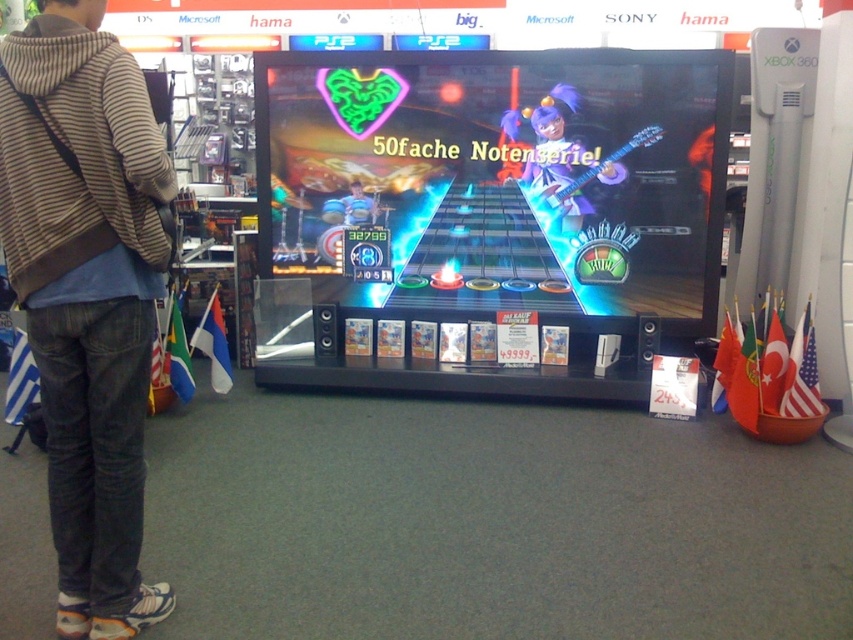
Does shiny plastic guitar at center have a greater width compared to blue denim jeans at center?

Yes, shiny plastic guitar at center is wider than blue denim jeans at center.

Consider the image. Which is above, shiny plastic guitar at center or blue denim jeans at center?

blue denim jeans at center is above.

The height and width of the screenshot is (640, 853). What do you see at coordinates (502, 180) in the screenshot?
I see `shiny plastic guitar at center` at bounding box center [502, 180].

The width and height of the screenshot is (853, 640). I want to click on shiny plastic guitar at center, so click(x=502, y=180).

Can you confirm if striped hoodie at center is smaller than purple hair at center?

Actually, striped hoodie at center might be larger than purple hair at center.

Who is more distant from viewer, (x=3, y=202) or (x=606, y=182)?

The point (x=606, y=182) is behind.

The width and height of the screenshot is (853, 640). Identify the location of striped hoodie at center. (86, 294).

Based on the photo, can you confirm if purple hair at center is positioned below blue denim jeans at center?

No, purple hair at center is not below blue denim jeans at center.

Can you confirm if purple hair at center is bigger than blue denim jeans at center?

Yes.

Does point (604, 182) lie in front of point (346, 221)?

Yes.

Where is `purple hair at center`? The image size is (853, 640). purple hair at center is located at coordinates (560, 161).